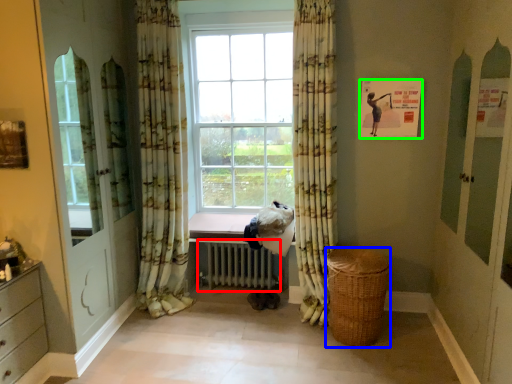
Question: Considering the real-world distances, which object is farthest from radiator (highlighted by a red box)? basket (highlighted by a blue box) or bulletin board (highlighted by a green box)?

Choices:
 (A) basket
 (B) bulletin board

Answer: (B)